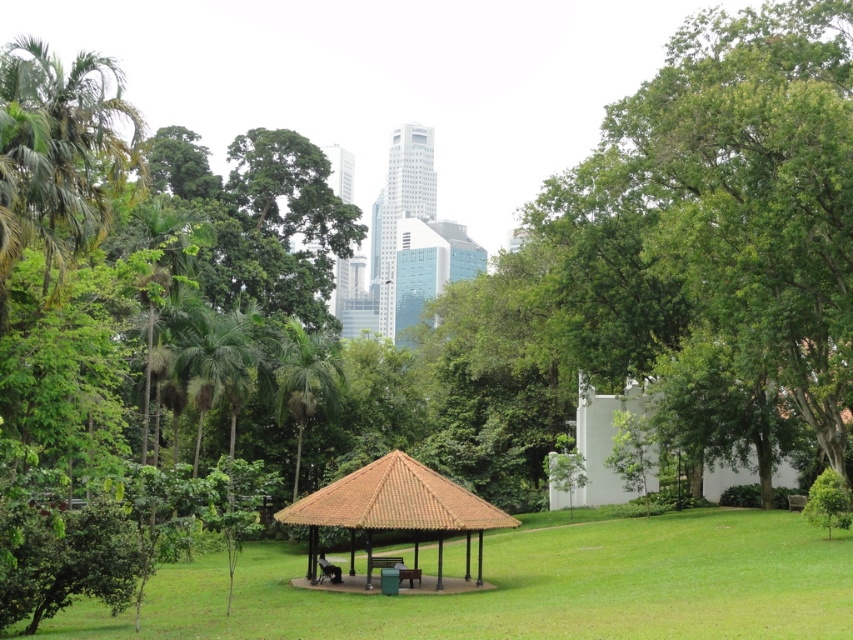
Which is in front, point (480, 518) or point (550, 506)?

Point (480, 518)

Is point (448, 531) positioned behind point (554, 504)?

That is False.

Who is more distant from viewer, [361,502] or [590,472]?

The point [590,472] is behind.

You are a GUI agent. You are given a task and a screenshot of the screen. Output one action in this format:
    pyautogui.click(x=<x>, y=<y>)
    Task: Click on the brown thatched roof gazebo at center
    This screenshot has width=853, height=640.
    Given the screenshot: What is the action you would take?
    pyautogui.click(x=395, y=509)

Is green leafy palm at left thinner than white matte/hardobject at center-right?

Correct, green leafy palm at left's width is less than white matte/hardobject at center-right's.

Which of these two, green leafy palm at left or white matte/hardobject at center-right, stands taller?

green leafy palm at left is taller.

Does point (54, 218) come farther from viewer compared to point (788, 467)?

No.

Locate an element on the screen. Image resolution: width=853 pixels, height=640 pixels. green leafy palm at left is located at coordinates (59, 152).

Does point (726, 324) come behind point (421, 572)?

Yes, point (726, 324) is behind point (421, 572).

Can you confirm if green leafy tree at center is positioned to the right of brown wooden picnic table at center?

Yes, green leafy tree at center is to the right of brown wooden picnic table at center.

Is point (762, 353) farther from camera compared to point (399, 557)?

No, it is not.

This screenshot has width=853, height=640. What are the coordinates of `green leafy tree at center` in the screenshot? It's located at (740, 195).